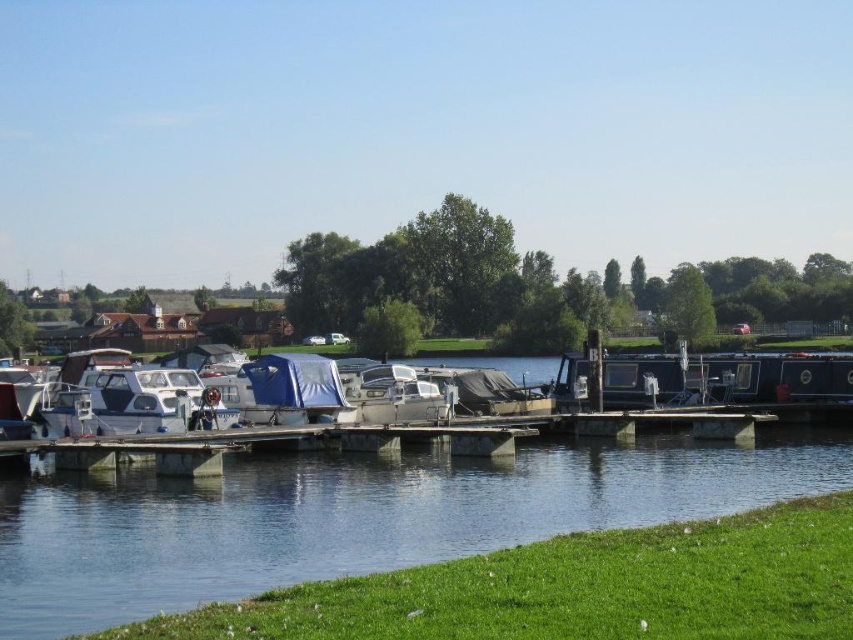
The height and width of the screenshot is (640, 853). Describe the element at coordinates (137, 404) in the screenshot. I see `white glossy boat at center` at that location.

Is white glossy boat at center bigger than metallic silver boat at center?

Yes, white glossy boat at center is bigger than metallic silver boat at center.

The height and width of the screenshot is (640, 853). What do you see at coordinates (137, 404) in the screenshot?
I see `white glossy boat at center` at bounding box center [137, 404].

The image size is (853, 640). Find the location of `white glossy boat at center`. white glossy boat at center is located at coordinates (137, 404).

Which of these two, clear water at center or white glossy boat at center, stands taller?

With more height is white glossy boat at center.

Which is more to the left, clear water at center or white glossy boat at center?

Positioned to the left is white glossy boat at center.

Is point (570, 451) behind point (114, 417)?

Yes, point (570, 451) is farther from viewer.

Locate an element on the screen. clear water at center is located at coordinates (357, 516).

Between clear water at center and metallic silver boat at center, which one appears on the right side from the viewer's perspective?

Positioned to the right is clear water at center.

Does clear water at center appear under metallic silver boat at center?

Yes.

Is point (352, 566) behind point (437, 394)?

No, it is in front of (437, 394).

Find the location of a particular element. The height and width of the screenshot is (640, 853). clear water at center is located at coordinates (357, 516).